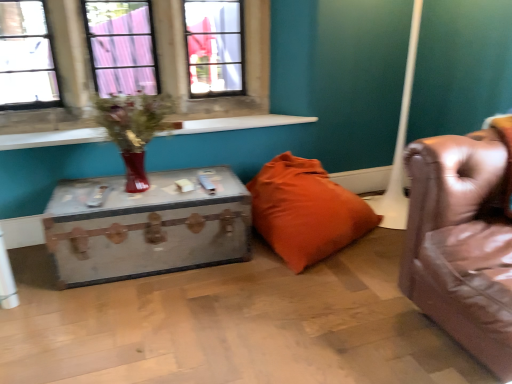
You are a GUI agent. You are given a task and a screenshot of the screen. Output one action in this format:
    pyautogui.click(x=<x>, y=<y>)
    Task: Click on the spots to the right of rustic wood trunk at center
    The width and height of the screenshot is (512, 384).
    Given the screenshot: What is the action you would take?
    pyautogui.click(x=273, y=293)